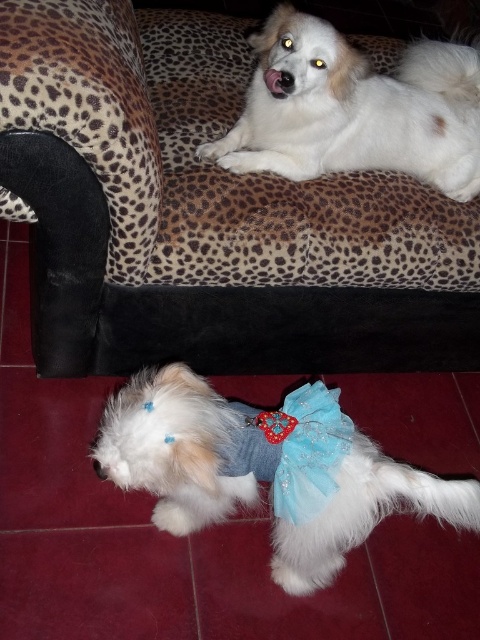
Can you confirm if leopard print fabric couch at upper center is positioned to the right of blue satin bow tie at lower center?

No, leopard print fabric couch at upper center is not to the right of blue satin bow tie at lower center.

Does leopard print fabric couch at upper center have a larger size compared to blue satin bow tie at lower center?

Correct, leopard print fabric couch at upper center is larger in size than blue satin bow tie at lower center.

What do you see at coordinates (192, 230) in the screenshot?
I see `leopard print fabric couch at upper center` at bounding box center [192, 230].

Where is `leopard print fabric couch at upper center`? This screenshot has height=640, width=480. leopard print fabric couch at upper center is located at coordinates (192, 230).

Does leopard print fabric couch at upper center have a greater height compared to white fluffy dog at lower center?

Yes.

Does leopard print fabric couch at upper center lie behind white fluffy dog at lower center?

Yes.

Identify the location of leopard print fabric couch at upper center. The image size is (480, 640). (192, 230).

Does white fluffy dog at lower center appear over blue satin bow tie at lower center?

Incorrect, white fluffy dog at lower center is not positioned above blue satin bow tie at lower center.

Which is behind, point (139, 445) or point (274, 436)?

Point (274, 436)

Where is `white fluffy dog at lower center`? white fluffy dog at lower center is located at coordinates (265, 470).